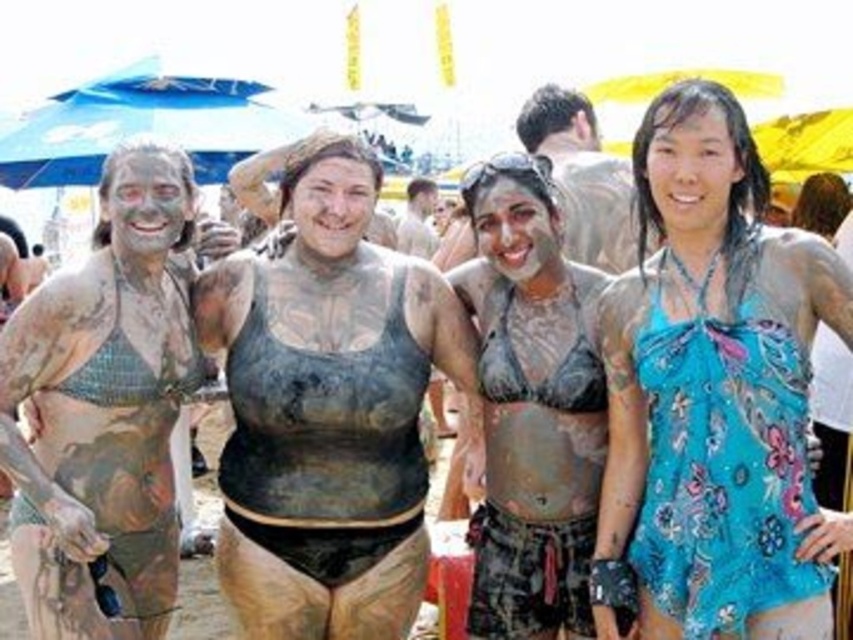
Question: Does matte clay face at center have a smaller size compared to matte mud face at center?

Choices:
 (A) yes
 (B) no

Answer: (B)

Question: Does blue floral dress at center appear on the right side of matte mud mask at left?

Choices:
 (A) yes
 (B) no

Answer: (A)

Question: Which object is the closest to the matte mud mask at left?

Choices:
 (A) smooth skin face at center
 (B) matte clay face at center
 (C) matte mud face at center

Answer: (C)

Question: Is smooth skin face at center wider than matte clay face at center?

Choices:
 (A) no
 (B) yes

Answer: (A)

Question: Which of these objects is positioned closest to the matte mud face at center?

Choices:
 (A) matte clay face at center
 (B) smooth skin face at center
 (C) blue floral dress at center
 (D) matte mud mask at left

Answer: (D)

Question: Which point appears farthest from the camera in this image?

Choices:
 (A) (334, 211)
 (B) (706, 177)
 (C) (526, 211)

Answer: (C)